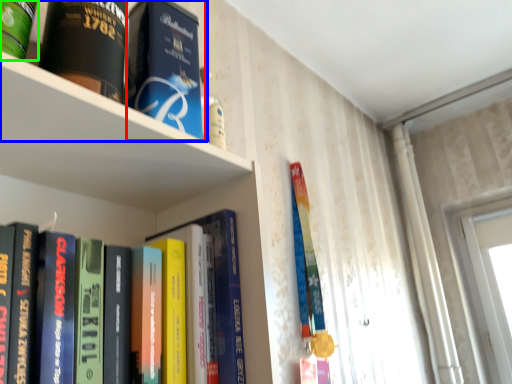
Question: Estimate the real-world distances between objects in this image. Which object is farther from book (highlighted by a red box), book (highlighted by a blue box) or book (highlighted by a green box)?

Choices:
 (A) book
 (B) book

Answer: (B)